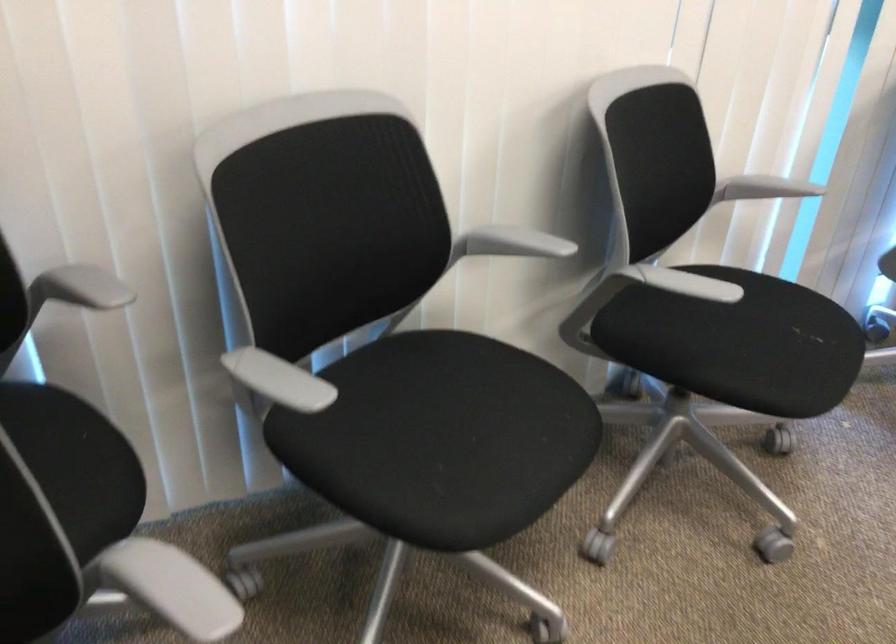
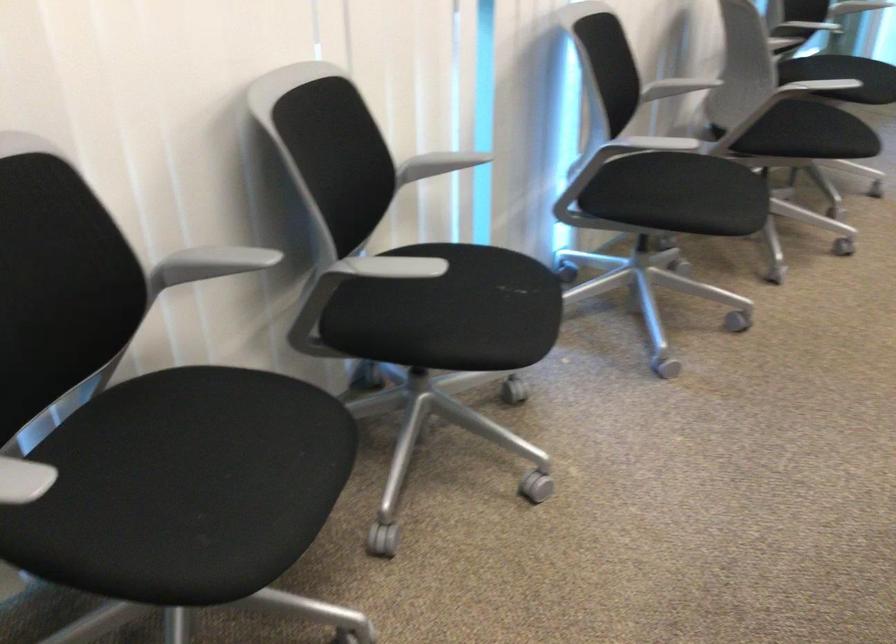
In the second image, find the point that corresponds to point (469, 424) in the first image.

(226, 456)